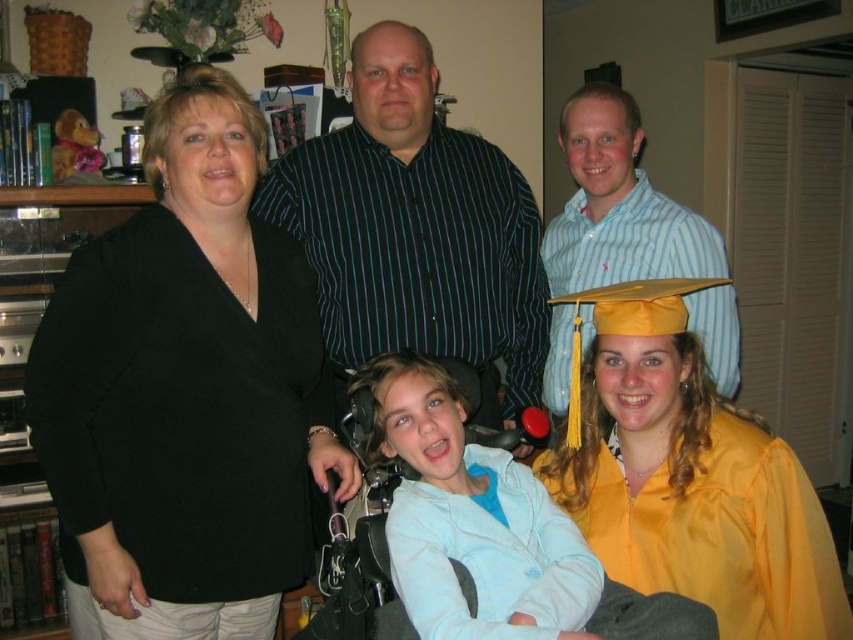
You are a photographer who needs to adjust the spacing between the black matte blazer at center and the yellow satin graduation gown at center to ensure they are exactly 24 inches apart for a better composition. How much space do you need to add or subtract?

The current distance between the black matte blazer at center and the yellow satin graduation gown at center is 17.15 inches. To reach the desired 24 inches, you need to add 6.85 inches of space between them.

You are a photographer trying to capture a photo of the group. You want to ensure the black matte blazer at center and the yellow satin graduation gown at center are both clearly visible. Based on their positions, which one should you focus on first to ensure both are in frame?

The black matte blazer at center is to the left of the yellow satin graduation gown at center. Since they are both at the center, focusing on the black matte blazer at center first will naturally include the yellow satin graduation gown at center in the frame as they are positioned next to each other.